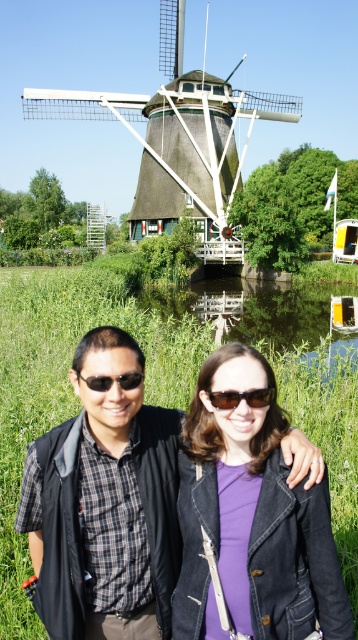
In the scene shown: You are a photographer trying to capture a clear shot of the matte black vest at center and the thatched roof windmill at upper center. Which object should you focus on first if you want to ensure both are in focus?

The matte black vest at center is below the thatched roof windmill at upper center, so you should focus on the thatched roof windmill at upper center first to ensure both are in focus.

You are a photographer trying to capture the two points in the scene. Which point is closer to the camera? The points are labeled as point 1 at coordinates point (x=254, y=394) and point 2 at coordinates point (x=102, y=378).

Point 1 at coordinates point (x=254, y=394) is in front of point 2 at coordinates point (x=102, y=378), so it is closer to the camera.